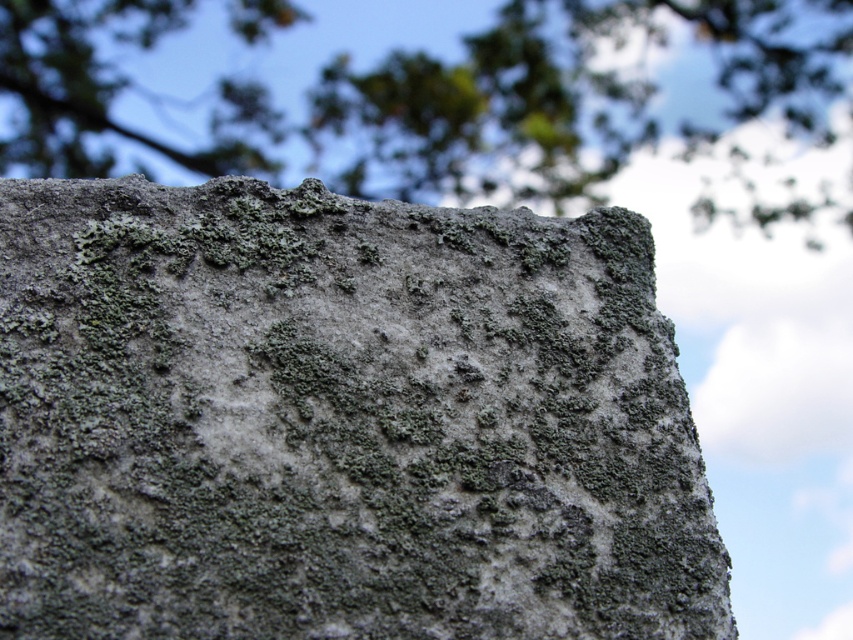
Is gray rough stone at upper center above green mossy rock at upper center?

No.

Is point (457, 476) in front of point (807, 216)?

That is True.

Identify the location of gray rough stone at upper center. (339, 420).